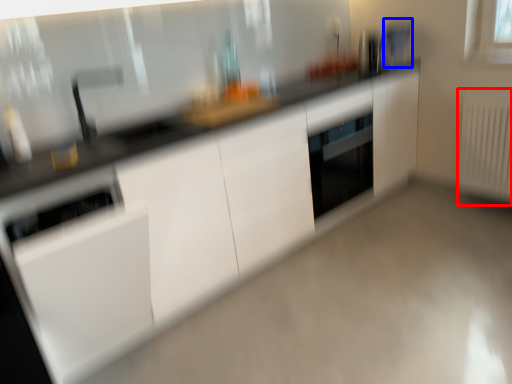
Question: Which object appears closest to the camera in this image, radiator (highlighted by a red box) or appliance (highlighted by a blue box)?

Choices:
 (A) radiator
 (B) appliance

Answer: (A)